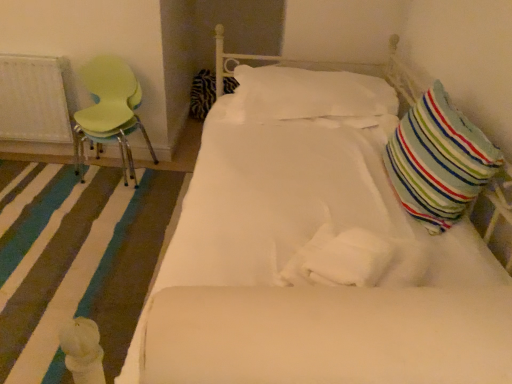
The image size is (512, 384). I want to click on vacant region to the left of light green plastic chair at left, so (41, 179).